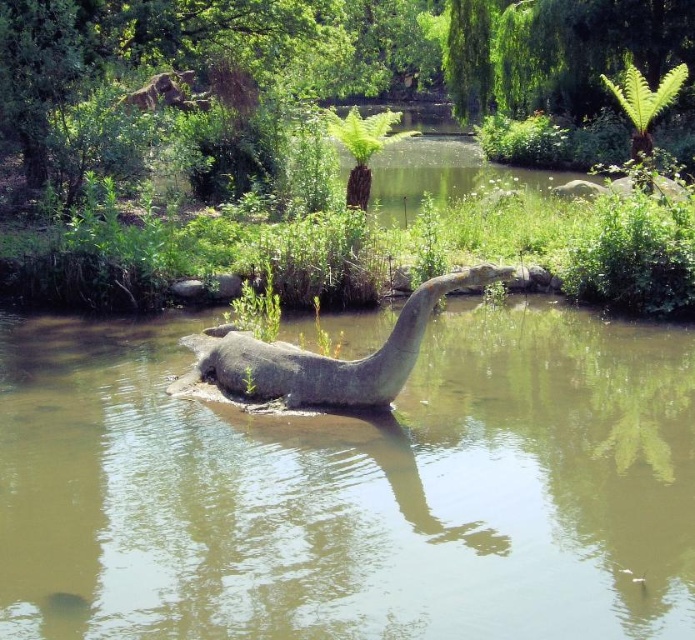
Which is behind, point (311, 524) or point (270, 374)?

Point (270, 374)

Does greenish-brown water at center lie in front of gray stone statue at center?

Yes, greenish-brown water at center is closer to the viewer.

Between point (612, 602) and point (252, 333), which one is positioned in front?

Point (612, 602) is more forward.

This screenshot has width=695, height=640. Identify the location of greenish-brown water at center. (352, 488).